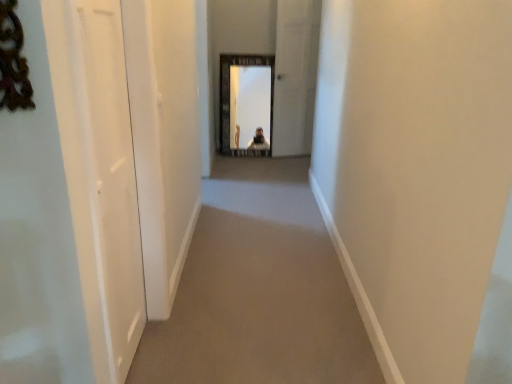
The width and height of the screenshot is (512, 384). I want to click on white glossy door at center, acting as the 1th screen door starting from the right, so click(x=295, y=76).

What do you see at coordinates (106, 182) in the screenshot? The height and width of the screenshot is (384, 512). I see `white glossy door at left, which ranks as the 2th screen door in top-to-bottom order` at bounding box center [106, 182].

In order to click on beige carpet at center in this screenshot , I will do `click(259, 290)`.

Can you confirm if white glossy door at center, which is counted as the 2th screen door, starting from the left, is taller than white glossy door at left, the 1th screen door when ordered from bottom to top?

Correct, white glossy door at center, which is counted as the 2th screen door, starting from the left, is much taller as white glossy door at left, the 1th screen door when ordered from bottom to top.

Is white glossy door at center, positioned as the 1th screen door in top-to-bottom order, far from white glossy door at left, the 2th screen door when ordered from back to front?

Yes.

Looking at their sizes, would you say white glossy door at center, the second screen door in the bottom-to-top sequence, is wider or thinner than white glossy door at left, acting as the 1th screen door starting from the front?

Considering their sizes, white glossy door at center, the second screen door in the bottom-to-top sequence, looks broader than white glossy door at left, acting as the 1th screen door starting from the front.

What's the angular difference between beige carpet at center and white glossy door at left, acting as the 1th screen door starting from the front,'s facing directions?

There is a 92.4-degree angle between the facing directions of beige carpet at center and white glossy door at left, acting as the 1th screen door starting from the front.

Is beige carpet at center oriented away from white glossy door at left, acting as the first screen door starting from the left?

No.

Which point is more forward, (x=227, y=211) or (x=105, y=83)?

The point (x=105, y=83) is closer to the camera.

From the image's perspective, is beige carpet at center above or below white glossy door at left, acting as the first screen door starting from the left?

From the image's perspective, beige carpet at center appears below white glossy door at left, acting as the first screen door starting from the left.

From the picture: Can we say white glossy door at left, acting as the first screen door starting from the left, lies outside white glossy door at center, the 2th screen door viewed from the front?

Yes, white glossy door at left, acting as the first screen door starting from the left, is located beyond the bounds of white glossy door at center, the 2th screen door viewed from the front.

Is white glossy door at left, the 1th screen door when ordered from bottom to top, touching white glossy door at center, positioned as the 1th screen door in top-to-bottom order?

No, white glossy door at left, the 1th screen door when ordered from bottom to top, is not making contact with white glossy door at center, positioned as the 1th screen door in top-to-bottom order.

Does white glossy door at left, placed as the 2th screen door when sorted from right to left, turn towards white glossy door at center, the 2th screen door viewed from the front?

No, white glossy door at left, placed as the 2th screen door when sorted from right to left, is not turned towards white glossy door at center, the 2th screen door viewed from the front.

Looking at this image, from the image's perspective, between white glossy door at left, the 2th screen door when ordered from back to front, and white glossy door at center, acting as the 1th screen door starting from the right, who is located below?

white glossy door at left, the 2th screen door when ordered from back to front, from the image's perspective.

Between white glossy door at center, the 2th screen door viewed from the front, and beige carpet at center, which one has smaller size?

Smaller between the two is white glossy door at center, the 2th screen door viewed from the front.

At what (x,y) coordinates should I click in order to perform the action: click on screen door that is the 2nd one above the beige carpet at center (from a real-world perspective). Please return your answer as a coordinate pair (x, y). The height and width of the screenshot is (384, 512). Looking at the image, I should click on pos(295,76).

From the image's perspective, which one is positioned lower, white glossy door at center, acting as the 1th screen door starting from the right, or beige carpet at center?

beige carpet at center.

Is white glossy door at center, the 2th screen door viewed from the front, positioned with its back to beige carpet at center?

No, white glossy door at center, the 2th screen door viewed from the front, is not facing the opposite direction of beige carpet at center.

Which is in front, point (241, 327) or point (287, 8)?

The point (241, 327) is in front.

You are a GUI agent. You are given a task and a screenshot of the screen. Output one action in this format:
    pyautogui.click(x=<x>, y=<y>)
    Task: Click on the corridor on the left of the white glossy door at center, the first screen door viewed from the back
    
    Given the screenshot: What is the action you would take?
    pyautogui.click(x=259, y=290)

Is beige carpet at center shorter than white glossy door at center, which is counted as the 2th screen door, starting from the left?

Correct, beige carpet at center is not as tall as white glossy door at center, which is counted as the 2th screen door, starting from the left.

Consider the image. Which of these two, beige carpet at center or white glossy door at center, which is counted as the 2th screen door, starting from the left, is bigger?

Bigger between the two is beige carpet at center.

From a real-world perspective, is white glossy door at left, the 2th screen door when ordered from back to front, beneath beige carpet at center?

Actually, white glossy door at left, the 2th screen door when ordered from back to front, is physically above beige carpet at center in the real world.

What's the angular difference between white glossy door at left, placed as the 2th screen door when sorted from right to left, and beige carpet at center's facing directions?

92.4 degrees separate the facing orientations of white glossy door at left, placed as the 2th screen door when sorted from right to left, and beige carpet at center.

Based on the photo, considering the positions of objects white glossy door at left, the 1th screen door when ordered from bottom to top, and beige carpet at center in the image provided, who is behind, white glossy door at left, the 1th screen door when ordered from bottom to top, or beige carpet at center?

beige carpet at center is further away from the camera.

Considering the sizes of objects white glossy door at left, acting as the 1th screen door starting from the front, and beige carpet at center in the image provided, who is shorter, white glossy door at left, acting as the 1th screen door starting from the front, or beige carpet at center?

Standing shorter between the two is beige carpet at center.

Find the location of a particular element. The height and width of the screenshot is (384, 512). screen door in front of the white glossy door at center, acting as the 1th screen door starting from the right is located at coordinates (106, 182).

The height and width of the screenshot is (384, 512). Find the location of `corridor to the right of white glossy door at left, which ranks as the 2th screen door in top-to-bottom order`. corridor to the right of white glossy door at left, which ranks as the 2th screen door in top-to-bottom order is located at coordinates (259, 290).

When comparing their distances from white glossy door at left, acting as the first screen door starting from the left, does white glossy door at center, acting as the 1th screen door starting from the right, or beige carpet at center seem closer?

beige carpet at center.

Based on their spatial positions, is white glossy door at left, acting as the 1th screen door starting from the front, or white glossy door at center, the 2th screen door viewed from the front, closer to beige carpet at center?

white glossy door at left, acting as the 1th screen door starting from the front, lies closer to beige carpet at center than the other object.

In the scene shown: When comparing their distances from white glossy door at center, the second screen door in the bottom-to-top sequence, does beige carpet at center or white glossy door at left, the 1th screen door when ordered from bottom to top, seem closer?

beige carpet at center is positioned closer to the anchor white glossy door at center, the second screen door in the bottom-to-top sequence.

From the picture: Looking at the image, which one is located further to white glossy door at left, placed as the 2th screen door when sorted from right to left, beige carpet at center or white glossy door at center, acting as the 1th screen door starting from the right?

white glossy door at center, acting as the 1th screen door starting from the right.

When comparing their distances from beige carpet at center, does white glossy door at center, which is counted as the 2th screen door, starting from the left, or white glossy door at left, the 2th screen door when ordered from back to front, seem further?

white glossy door at center, which is counted as the 2th screen door, starting from the left, is positioned further to the anchor beige carpet at center.

When comparing their distances from white glossy door at center, positioned as the 1th screen door in top-to-bottom order, does white glossy door at left, the 2th screen door when ordered from back to front, or beige carpet at center seem further?

Among the two, white glossy door at left, the 2th screen door when ordered from back to front, is located further to white glossy door at center, positioned as the 1th screen door in top-to-bottom order.

Image resolution: width=512 pixels, height=384 pixels. What are the coordinates of `corridor between white glossy door at left, placed as the 2th screen door when sorted from right to left, and white glossy door at center, the second screen door in the bottom-to-top sequence, along the z-axis` in the screenshot? It's located at (259, 290).